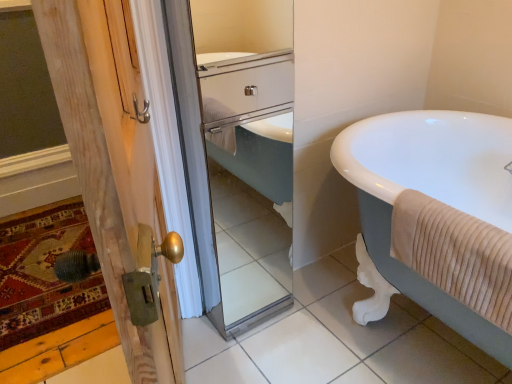
Where is `wooden door at left`? The image size is (512, 384). wooden door at left is located at coordinates (113, 162).

Identify the location of clear glass mirror at center. Image resolution: width=512 pixels, height=384 pixels. (237, 173).

Image resolution: width=512 pixels, height=384 pixels. What do you see at coordinates (435, 218) in the screenshot? I see `white glossy bathtub at right` at bounding box center [435, 218].

Find the location of `wooden door at left`. wooden door at left is located at coordinates (113, 162).

This screenshot has width=512, height=384. Find the location of `bath towel lying on the left of white glossy bathtub at right`. bath towel lying on the left of white glossy bathtub at right is located at coordinates (455, 254).

Does white glossy bathtub at right have a smaller size compared to beige ribbed towel at right?

Incorrect, white glossy bathtub at right is not smaller in size than beige ribbed towel at right.

Considering the sizes of objects white glossy bathtub at right and beige ribbed towel at right in the image provided, who is thinner, white glossy bathtub at right or beige ribbed towel at right?

With smaller width is beige ribbed towel at right.

Is white glossy bathtub at right in front of or behind beige ribbed towel at right in the image?

In the image, white glossy bathtub at right appears in front of beige ribbed towel at right.

From a real-world perspective, which object rests below the other?

wooden door at left, from a real-world perspective.

Is wooden door at left far away from beige ribbed towel at right?

They are positioned close to each other.

How different are the orientations of wooden door at left and beige ribbed towel at right in degrees?

There is a 92.1-degree angle between the facing directions of wooden door at left and beige ribbed towel at right.

In terms of width, does wooden door at left look wider or thinner when compared to beige ribbed towel at right?

wooden door at left is wider than beige ribbed towel at right.

Between wooden door at left and clear glass mirror at center, which one has larger width?

wooden door at left is wider.

Is wooden door at left completely or partially outside of clear glass mirror at center?

wooden door at left is positioned outside clear glass mirror at center.

Is point (134, 168) positioned before point (186, 39)?

Yes, point (134, 168) is closer to viewer.

From a real-world perspective, which is physically above, beige ribbed towel at right or wooden door at left?

beige ribbed towel at right is physically above.

Can you see beige ribbed towel at right touching wooden door at left?

beige ribbed towel at right and wooden door at left are clearly separated.

Between beige ribbed towel at right and wooden door at left, which one has smaller width?

With smaller width is beige ribbed towel at right.

Which is correct: beige ribbed towel at right is inside wooden door at left, or outside of it?

beige ribbed towel at right lies outside wooden door at left.

Where is `screen door behind the beige ribbed towel at right`? Image resolution: width=512 pixels, height=384 pixels. screen door behind the beige ribbed towel at right is located at coordinates (237, 173).

Which point is more distant from viewer, (221, 103) or (466, 273)?

The point (221, 103) is farther.

From the image's perspective, is clear glass mirror at center located above or below beige ribbed towel at right?

From the image's perspective, clear glass mirror at center appears above beige ribbed towel at right.

In terms of height, does clear glass mirror at center look taller or shorter compared to wooden door at left?

In the image, clear glass mirror at center appears to be shorter than wooden door at left.

Can you tell me how much clear glass mirror at center and wooden door at left differ in facing direction?

They differ by 2.24 degrees in their facing directions.

Is clear glass mirror at center far away from wooden door at left?

That's not correct — clear glass mirror at center is a little close to wooden door at left.

This screenshot has height=384, width=512. Identify the location of screen door above the wooden door at left (from the image's perspective). (237, 173).

Looking at their sizes, would you say beige ribbed towel at right is wider or thinner than white glossy bathtub at right?

beige ribbed towel at right is thinner than white glossy bathtub at right.

Between beige ribbed towel at right and white glossy bathtub at right, which one has larger size?

white glossy bathtub at right.

Is beige ribbed towel at right taller than white glossy bathtub at right?

No.

Does point (476, 256) appear closer or farther from the camera than point (392, 138)?

Point (476, 256) is closer to the camera than point (392, 138).

Find the location of a particular element. bathtub below the beige ribbed towel at right (from a real-world perspective) is located at coordinates (435, 218).

Where is `bath towel behind the wooden door at left`? This screenshot has width=512, height=384. bath towel behind the wooden door at left is located at coordinates (455, 254).

From the image, which object appears to be farther from beige ribbed towel at right, clear glass mirror at center or wooden door at left?

clear glass mirror at center lies further to beige ribbed towel at right than the other object.

Looking at the image, which one is located further to wooden door at left, clear glass mirror at center or white glossy bathtub at right?

Based on the image, white glossy bathtub at right appears to be further to wooden door at left.

From the image, which object appears to be farther from clear glass mirror at center, beige ribbed towel at right or white glossy bathtub at right?

beige ribbed towel at right lies further to clear glass mirror at center than the other object.

Consider the image. Estimate the real-world distances between objects in this image. Which object is further from white glossy bathtub at right, clear glass mirror at center or beige ribbed towel at right?

The object further to white glossy bathtub at right is clear glass mirror at center.

Estimate the real-world distances between objects in this image. Which object is further from wooden door at left, white glossy bathtub at right or clear glass mirror at center?

white glossy bathtub at right is positioned further to the anchor wooden door at left.

When comparing their distances from white glossy bathtub at right, does wooden door at left or clear glass mirror at center seem closer?

clear glass mirror at center is positioned closer to the anchor white glossy bathtub at right.

Based on their spatial positions, is wooden door at left or clear glass mirror at center closer to beige ribbed towel at right?

wooden door at left is closer to beige ribbed towel at right.

Based on the photo, when comparing their distances from wooden door at left, does clear glass mirror at center or beige ribbed towel at right seem further?

Among the two, beige ribbed towel at right is located further to wooden door at left.

Where is `screen door located between wooden door at left and white glossy bathtub at right in the left-right direction`? screen door located between wooden door at left and white glossy bathtub at right in the left-right direction is located at coordinates (237, 173).

The image size is (512, 384). I want to click on screen door between wooden door at left and beige ribbed towel at right from left to right, so click(x=237, y=173).

You are a GUI agent. You are given a task and a screenshot of the screen. Output one action in this format:
    pyautogui.click(x=<x>, y=<y>)
    Task: Click on the bath towel between wooden door at left and white glossy bathtub at right from left to right
    The width and height of the screenshot is (512, 384).
    Given the screenshot: What is the action you would take?
    pyautogui.click(x=455, y=254)

Locate an element on the screen. The width and height of the screenshot is (512, 384). bath towel between clear glass mirror at center and white glossy bathtub at right from left to right is located at coordinates (455, 254).